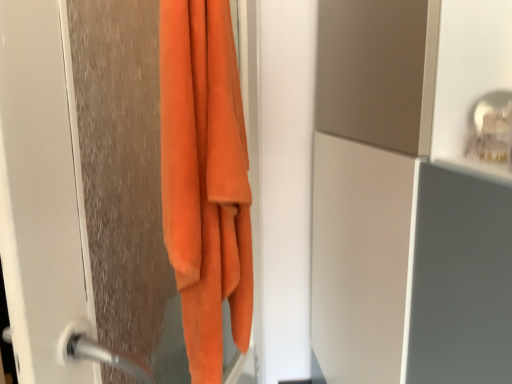
Image resolution: width=512 pixels, height=384 pixels. I want to click on orange soft towel at left, so click(x=205, y=178).

What do you see at coordinates (205, 178) in the screenshot?
I see `orange soft towel at left` at bounding box center [205, 178].

At what (x,y) coordinates should I click in order to perform the action: click on orange fuzzy towel at left. Please return your answer as a coordinate pair (x, y). This screenshot has height=384, width=512. Looking at the image, I should click on (84, 190).

This screenshot has height=384, width=512. What do you see at coordinates (84, 190) in the screenshot?
I see `orange fuzzy towel at left` at bounding box center [84, 190].

Where is `orange soft towel at left`? This screenshot has height=384, width=512. orange soft towel at left is located at coordinates (205, 178).

Is orange soft towel at left to the left or to the right of orange fuzzy towel at left in the image?

orange soft towel at left is positioned on orange fuzzy towel at left's right side.

Is orange soft towel at left further to camera compared to orange fuzzy towel at left?

Yes, orange soft towel at left is further from the viewer.

Which point is more distant from viewer, (166, 18) or (161, 244)?

Point (161, 244)

From the image's perspective, does orange soft towel at left appear higher than orange fuzzy towel at left?

Correct, orange soft towel at left appears higher than orange fuzzy towel at left in the image.

From a real-world perspective, is orange soft towel at left physically located above or below orange fuzzy towel at left?

Clearly, from a real-world perspective, orange soft towel at left is above orange fuzzy towel at left.

Between orange soft towel at left and orange fuzzy towel at left, which one has larger width?

Wider between the two is orange fuzzy towel at left.

Is orange soft towel at left taller than orange fuzzy towel at left?

No.

Does orange soft towel at left have a larger size compared to orange fuzzy towel at left?

No.

Is orange fuzzy towel at left surrounded by orange soft towel at left?

Actually, orange fuzzy towel at left is outside orange soft towel at left.

Is orange soft towel at left not near orange fuzzy towel at left?

They are positioned close to each other.

Is orange soft towel at left facing away from orange fuzzy towel at left?

That's right, orange soft towel at left is facing away from orange fuzzy towel at left.

Can you tell me how much orange soft towel at left and orange fuzzy towel at left differ in facing direction?

orange soft towel at left and orange fuzzy towel at left are facing 175 degrees away from each other.

Where is `screen door below the orange soft towel at left (from the image's perspective)`? screen door below the orange soft towel at left (from the image's perspective) is located at coordinates (84, 190).

Which object is positioned more to the right, orange fuzzy towel at left or orange soft towel at left?

From the viewer's perspective, orange soft towel at left appears more on the right side.

Considering the relative positions of orange fuzzy towel at left and orange soft towel at left in the image provided, is orange fuzzy towel at left behind orange soft towel at left?

No, orange fuzzy towel at left is closer to the viewer.

Which is closer, (69, 230) or (249, 271)?

The point (69, 230) is in front.

From the image's perspective, which object appears higher, orange fuzzy towel at left or orange soft towel at left?

orange soft towel at left, from the image's perspective.

From a real-world perspective, which object stands above the other?

orange soft towel at left is physically above.

Can you confirm if orange fuzzy towel at left is thinner than orange soft towel at left?

In fact, orange fuzzy towel at left might be wider than orange soft towel at left.

Does orange fuzzy towel at left have a lesser height compared to orange soft towel at left?

No, orange fuzzy towel at left is not shorter than orange soft towel at left.

Is orange fuzzy towel at left bigger than orange soft towel at left?

Yes.

Is orange soft towel at left completely or partially inside orange fuzzy towel at left?

Yes, orange fuzzy towel at left is surrounding orange soft towel at left.

Is orange fuzzy towel at left far from orange soft towel at left?

No, orange fuzzy towel at left is in close proximity to orange soft towel at left.

Is orange fuzzy towel at left aimed at orange soft towel at left?

Yes, orange fuzzy towel at left is facing orange soft towel at left.

From the picture: Can you tell me how much orange fuzzy towel at left and orange soft towel at left differ in facing direction?

They differ by 175 degrees in their facing directions.

Measure the distance between orange fuzzy towel at left and orange soft towel at left.

orange fuzzy towel at left and orange soft towel at left are 2.97 inches apart.

Identify the location of towel on the right of orange fuzzy towel at left. The height and width of the screenshot is (384, 512). [x=205, y=178].

Where is `screen door below the orange soft towel at left (from the image's perspective)`? Image resolution: width=512 pixels, height=384 pixels. screen door below the orange soft towel at left (from the image's perspective) is located at coordinates (84, 190).

Where is `screen door on the left of the orange soft towel at left`? The height and width of the screenshot is (384, 512). screen door on the left of the orange soft towel at left is located at coordinates (84, 190).